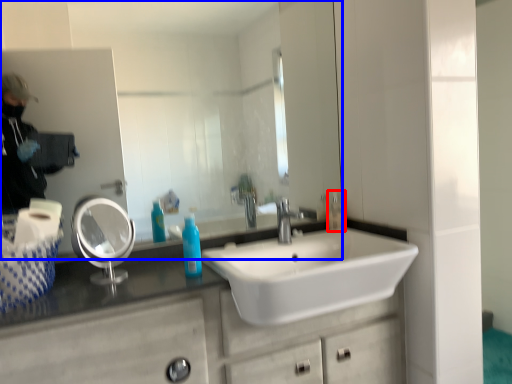
Question: Which point is closer to the camera, toiletry (highlighted by a red box) or mirror (highlighted by a blue box)?

Choices:
 (A) toiletry
 (B) mirror

Answer: (B)